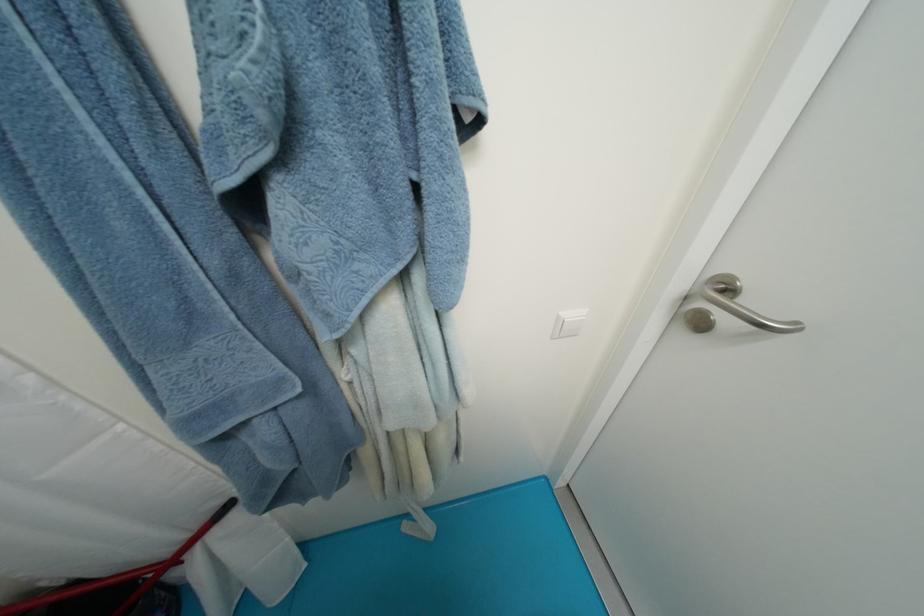
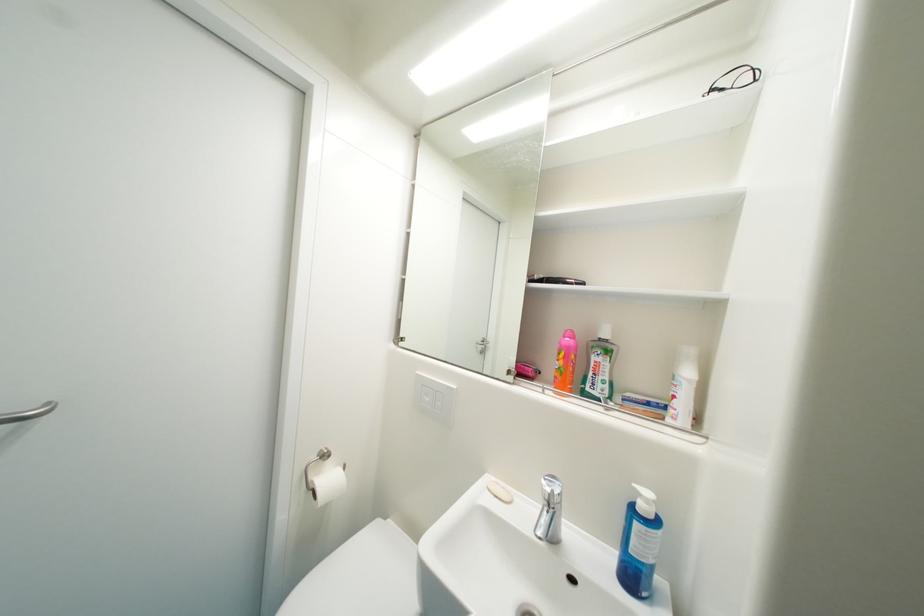
Locate, in the second image, the point that corresponds to point (804, 325) in the first image.

(55, 405)